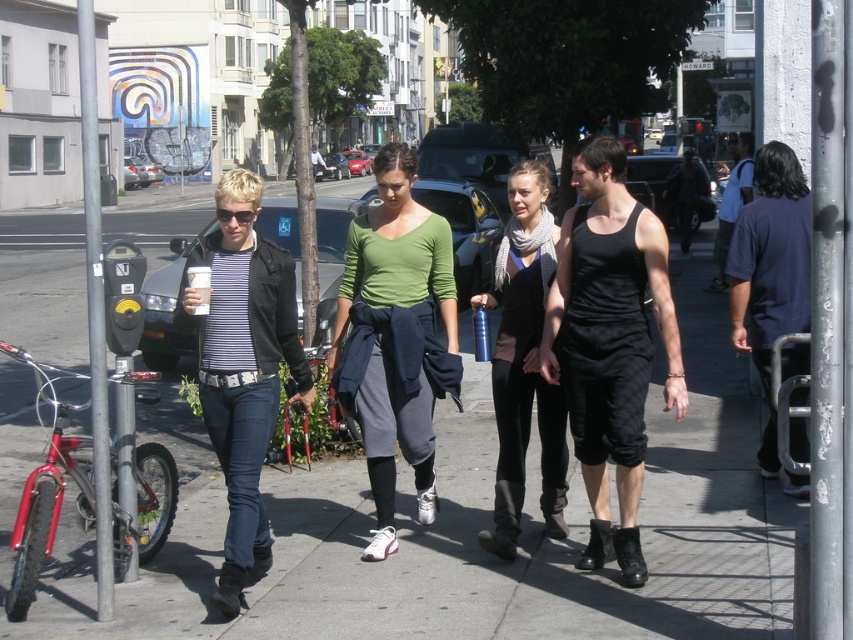
In the urban street scene, there are two people wearing the green matte shirt at center and the matte black vest at center. Which one is positioned more to the left?

The green matte shirt at center is positioned to the left of the matte black vest at center.

You are standing at the point marked as point (390, 369). There are two people walking on the sidewalk. The first person is wearing a striped shirt and black jacket, and the second person is in a green long sleeve top. How far apart are these two people?

The two people are 5.81 meters apart.

Based on the photo, you are a fashion designer observing the urban street scene. You notice two individuals wearing the green matte shirt at center and the dark blue shirt at right. Which of these two shirts has a narrower width?

The green matte shirt at center has a narrower width than the dark blue shirt at right.